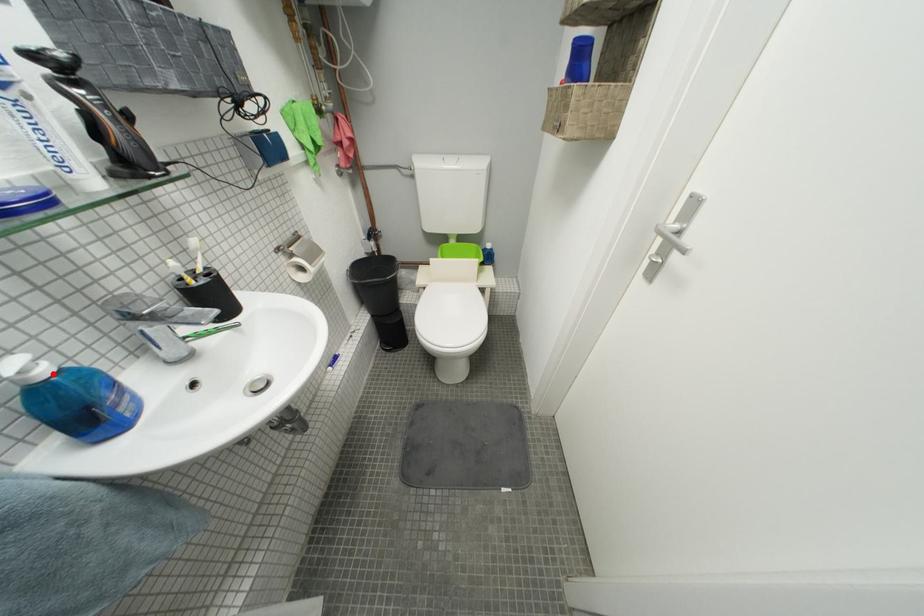
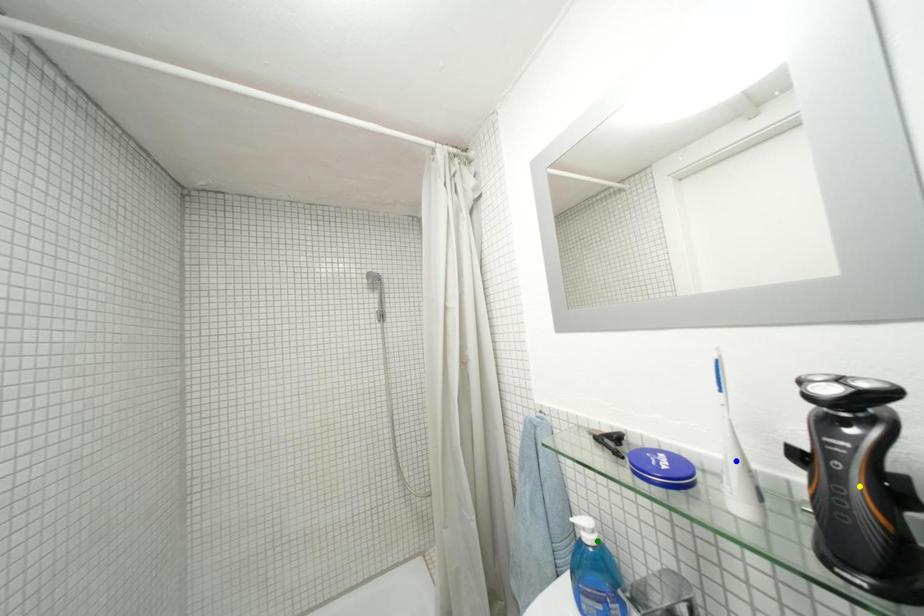
Question: I am providing you with two images of the same scene from different viewpoints. A red point is marked on the first image. You are given multiple points on the second image. Which spot in image 2 lines up with the point in image 1?

Choices:
 (A) green point
 (B) blue point
 (C) yellow point

Answer: (A)